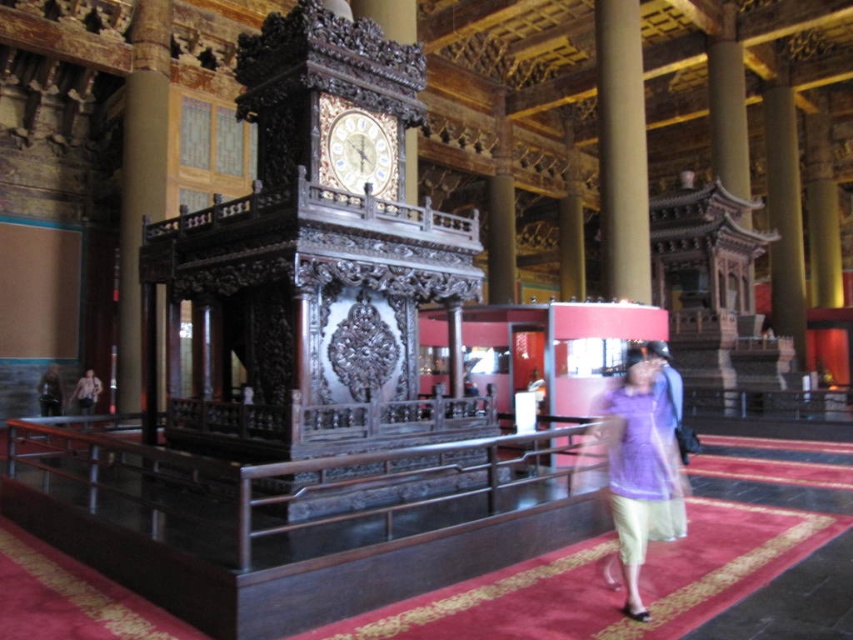
Does gold metallic clock at center have a lesser height compared to carved wood structure at upper right?

Yes, gold metallic clock at center is shorter than carved wood structure at upper right.

How far apart are gold metallic clock at center and carved wood structure at upper right?

gold metallic clock at center and carved wood structure at upper right are 112.56 feet apart from each other.

Describe the element at coordinates (357, 148) in the screenshot. I see `gold metallic clock at center` at that location.

Identify the location of gold metallic clock at center. The image size is (853, 640). (357, 148).

Is purple fabric dress at center bigger than gold metallic clock at center?

Indeed, purple fabric dress at center has a larger size compared to gold metallic clock at center.

Is purple fabric dress at center above gold metallic clock at center?

No, purple fabric dress at center is not above gold metallic clock at center.

At what (x,y) coordinates should I click in order to perform the action: click on purple fabric dress at center. Please return your answer as a coordinate pair (x, y). This screenshot has width=853, height=640. Looking at the image, I should click on (643, 461).

This screenshot has width=853, height=640. What are the coordinates of `purple fabric dress at center` in the screenshot? It's located at (643, 461).

Is matte black person at center smaller than light purple fabric dress at lower center?

Incorrect, matte black person at center is not smaller in size than light purple fabric dress at lower center.

Is matte black person at center closer to the viewer compared to light purple fabric dress at lower center?

Yes, it is in front of light purple fabric dress at lower center.

Locate an element on the screen. matte black person at center is located at coordinates (50, 392).